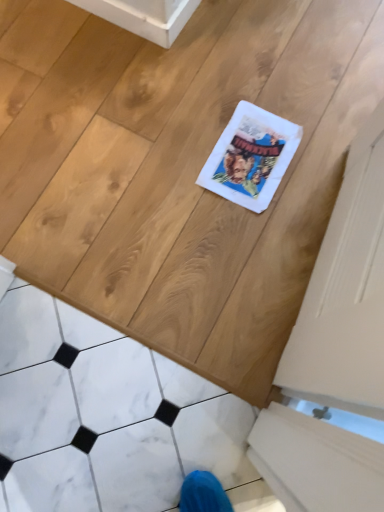
Locate an element on the screen. free point below white matte screen door at right (from a real-world perspective) is located at coordinates (309, 260).